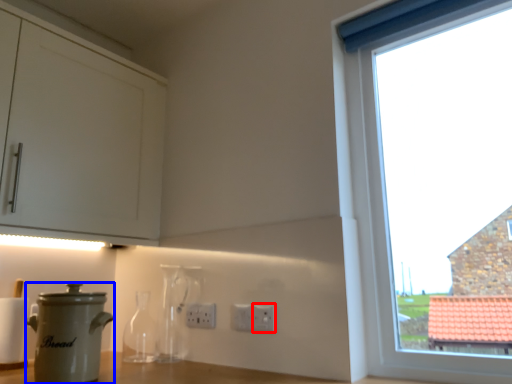
Question: Which of the following is the farthest to the observer, electric outlet (highlighted by a red box) or kitchen appliance (highlighted by a blue box)?

Choices:
 (A) electric outlet
 (B) kitchen appliance

Answer: (A)